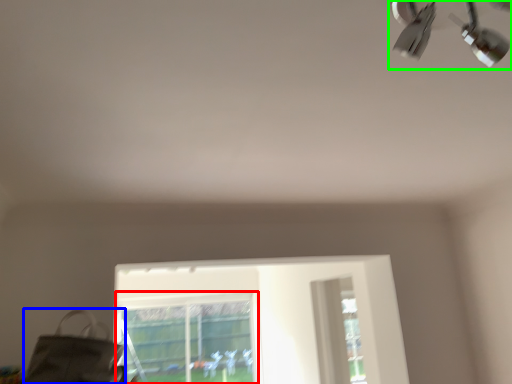
Question: Which object is positioned farthest from bay window (highlighted by a red box)? Select from messenger bag (highlighted by a blue box) and lamp (highlighted by a green box).

Choices:
 (A) messenger bag
 (B) lamp

Answer: (B)